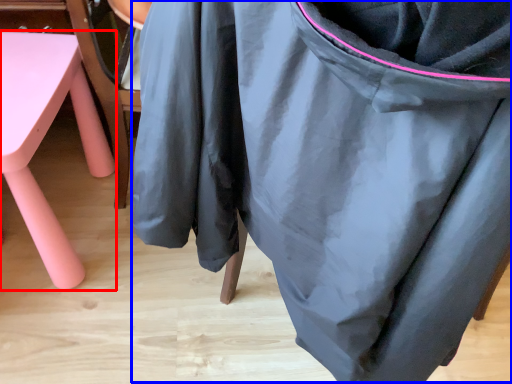
Question: Which point is further to the camera, furniture (highlighted by a red box) or bean bag chair (highlighted by a blue box)?

Choices:
 (A) furniture
 (B) bean bag chair

Answer: (A)